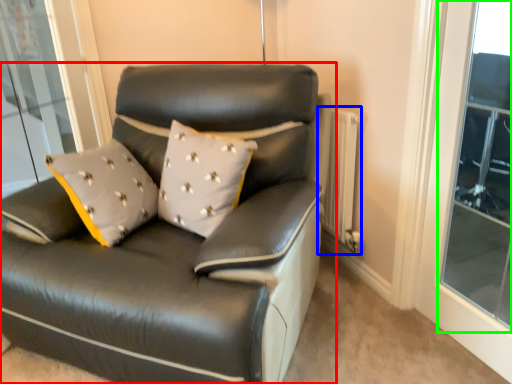
Question: Based on their relative distances, which object is nearer to studio couch (highlighted by a red box)? Choose from radiator (highlighted by a blue box) and window (highlighted by a green box).

Choices:
 (A) radiator
 (B) window

Answer: (A)